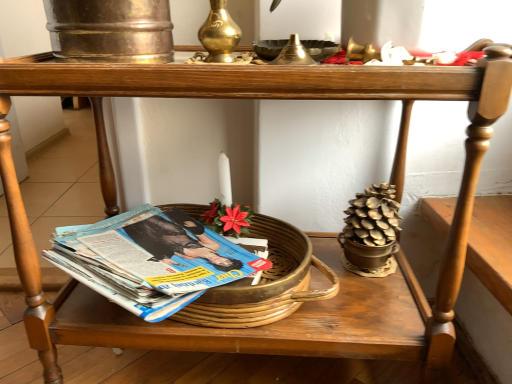
Question: Can you confirm if gold metallic candle holder at upper center, the second candle holder in the left-to-right sequence, is taller than metallic gold bowl at upper center?

Choices:
 (A) no
 (B) yes

Answer: (B)

Question: From a real-world perspective, does gold metallic candle holder at upper center, the second candle holder in the left-to-right sequence, sit lower than metallic gold bowl at upper center?

Choices:
 (A) yes
 (B) no

Answer: (B)

Question: Does gold metallic candle holder at upper center, the second candle holder in the left-to-right sequence, appear on the left side of metallic gold bowl at upper center?

Choices:
 (A) yes
 (B) no

Answer: (A)

Question: Is gold metallic candle holder at upper center, acting as the first candle holder starting from the right, to the right of metallic gold bowl at upper center from the viewer's perspective?

Choices:
 (A) no
 (B) yes

Answer: (A)

Question: Does gold metallic candle holder at upper center, the second candle holder in the left-to-right sequence, have a larger size compared to metallic gold bowl at upper center?

Choices:
 (A) no
 (B) yes

Answer: (A)

Question: Considering the positions of point (79, 326) and point (154, 294), is point (79, 326) closer or farther from the camera than point (154, 294)?

Choices:
 (A) farther
 (B) closer

Answer: (A)

Question: From a real-world perspective, relative to blue glossy magazine at lower left, is wooden table at lower center vertically above or below?

Choices:
 (A) below
 (B) above

Answer: (A)

Question: Is wooden table at lower center inside or outside of blue glossy magazine at lower left?

Choices:
 (A) outside
 (B) inside

Answer: (A)

Question: From the image's perspective, is wooden table at lower center above or below blue glossy magazine at lower left?

Choices:
 (A) above
 (B) below

Answer: (B)

Question: Considering the positions of point (227, 49) and point (272, 59), is point (227, 49) closer or farther from the camera than point (272, 59)?

Choices:
 (A) farther
 (B) closer

Answer: (A)

Question: Choose the correct answer: Is brass candle holder at upper center, placed as the 1th candle holder when sorted from left to right, inside gold metallic candle holder at upper center, acting as the first candle holder starting from the right, or outside it?

Choices:
 (A) outside
 (B) inside

Answer: (A)

Question: In terms of width, does brass candle holder at upper center, placed as the 1th candle holder when sorted from left to right, look wider or thinner when compared to gold metallic candle holder at upper center, acting as the first candle holder starting from the right?

Choices:
 (A) thin
 (B) wide

Answer: (B)

Question: Considering the positions of brass candle holder at upper center, placed as the 1th candle holder when sorted from left to right, and gold metallic candle holder at upper center, acting as the first candle holder starting from the right, in the image, is brass candle holder at upper center, placed as the 1th candle holder when sorted from left to right, bigger or smaller than gold metallic candle holder at upper center, acting as the first candle holder starting from the right,?

Choices:
 (A) small
 (B) big

Answer: (B)

Question: From a real-world perspective, is brass candle holder at upper center, positioned as the 2th candle holder in right-to-left order, positioned above or below metallic gold bowl at upper center?

Choices:
 (A) above
 (B) below

Answer: (A)

Question: Is brass candle holder at upper center, placed as the 1th candle holder when sorted from left to right, taller or shorter than metallic gold bowl at upper center?

Choices:
 (A) tall
 (B) short

Answer: (A)